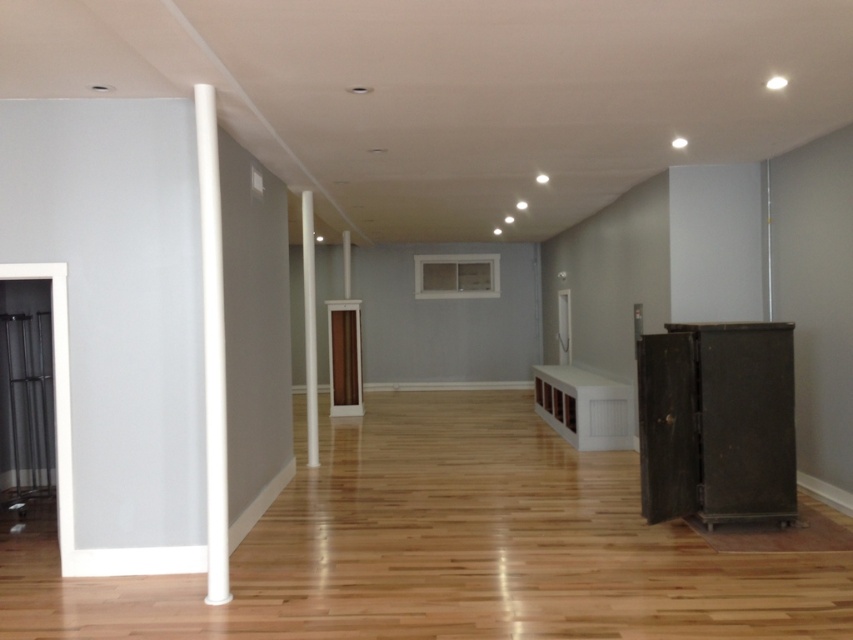
Is white smooth pole at left to the right of white glossy pillar at center from the viewer's perspective?

Correct, you'll find white smooth pole at left to the right of white glossy pillar at center.

Who is positioned more to the right, white smooth pole at left or white glossy pillar at center?

From the viewer's perspective, white smooth pole at left appears more on the right side.

Is point (206, 429) farther from camera compared to point (306, 326)?

No, it is not.

The width and height of the screenshot is (853, 640). In order to click on white smooth pole at left in this screenshot , I will do `click(212, 346)`.